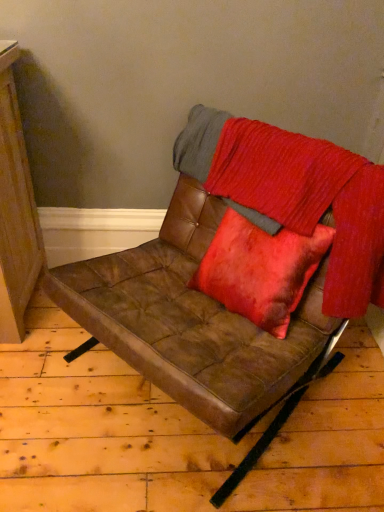
Question: From a real-world perspective, is velvet red blanket at center positioned above or below brown leather chair at center?

Choices:
 (A) above
 (B) below

Answer: (A)

Question: Does point pyautogui.click(x=340, y=234) appear closer or farther from the camera than point pyautogui.click(x=112, y=309)?

Choices:
 (A) closer
 (B) farther

Answer: (B)

Question: Considering the positions of velvet red blanket at center and brown leather chair at center in the image, is velvet red blanket at center taller or shorter than brown leather chair at center?

Choices:
 (A) short
 (B) tall

Answer: (A)

Question: Considering the positions of point (339, 162) and point (347, 152), is point (339, 162) closer or farther from the camera than point (347, 152)?

Choices:
 (A) farther
 (B) closer

Answer: (B)

Question: In the image, is brown leather chair at center positioned in front of or behind velvet red blanket at center?

Choices:
 (A) front
 (B) behind

Answer: (A)

Question: Is brown leather chair at center taller or shorter than velvet red blanket at center?

Choices:
 (A) short
 (B) tall

Answer: (B)

Question: Considering the positions of brown leather chair at center and velvet red blanket at center in the image, is brown leather chair at center wider or thinner than velvet red blanket at center?

Choices:
 (A) thin
 (B) wide

Answer: (B)